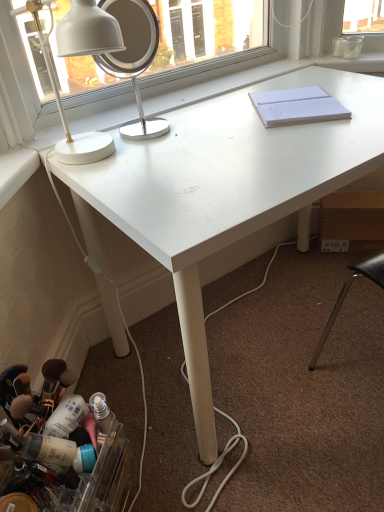
At what (x,y) coordinates should I click in order to perform the action: click on vacant area situated below white glossy desk lamp at upper left (from a real-world perspective). Please return your answer as a coordinate pair (x, y). The width and height of the screenshot is (384, 512). Looking at the image, I should click on (110, 161).